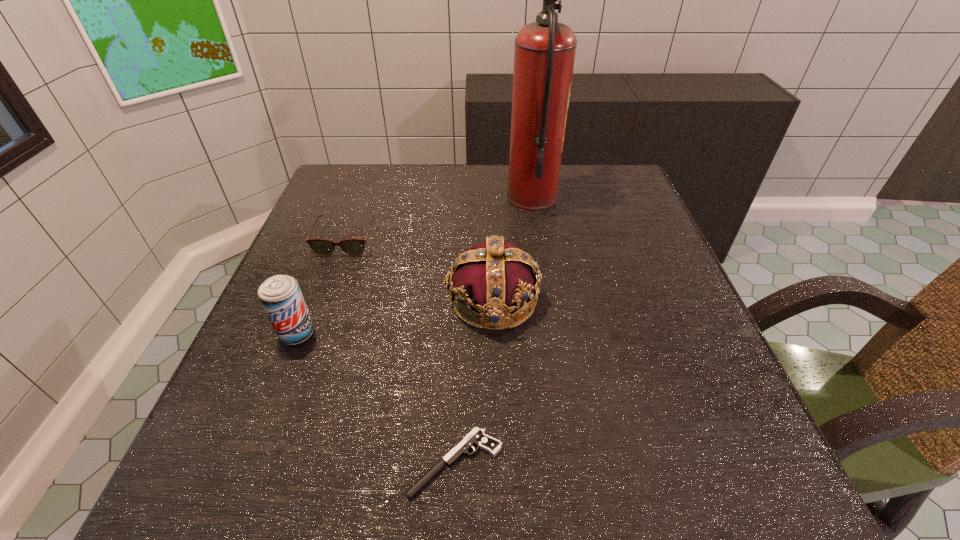
The height and width of the screenshot is (540, 960). Find the location of `free space located 0.210m at the nozzle of the farthest object`. free space located 0.210m at the nozzle of the farthest object is located at coordinates (427, 198).

Locate an element on the screen. vacant space located on the left of the crown is located at coordinates (331, 300).

Identify the location of vacant position located on the right of the beer can. Image resolution: width=960 pixels, height=540 pixels. (481, 334).

Where is `vacant space located 0.380m at the front view of the spectacles`? The height and width of the screenshot is (540, 960). vacant space located 0.380m at the front view of the spectacles is located at coordinates pos(285,409).

Where is `vacant space situated 0.210m on the front-facing side of the nearest object`? The image size is (960, 540). vacant space situated 0.210m on the front-facing side of the nearest object is located at coordinates (266, 463).

You are a GUI agent. You are given a task and a screenshot of the screen. Output one action in this format:
    pyautogui.click(x=<x>, y=<y>)
    Task: Click on the vacant area situated 0.110m on the front-facing side of the nearest object
    The image size is (960, 540).
    Given the screenshot: What is the action you would take?
    pyautogui.click(x=334, y=463)

Locate an element on the screen. The height and width of the screenshot is (540, 960). vacant point located 0.100m on the front-facing side of the nearest object is located at coordinates (341, 463).

Identify the location of object at the far edge. (544, 55).

The width and height of the screenshot is (960, 540). In order to click on object at the near edge in this screenshot , I will do `click(476, 437)`.

Locate an element on the screen. This screenshot has width=960, height=540. beer can present at the left edge is located at coordinates (280, 295).